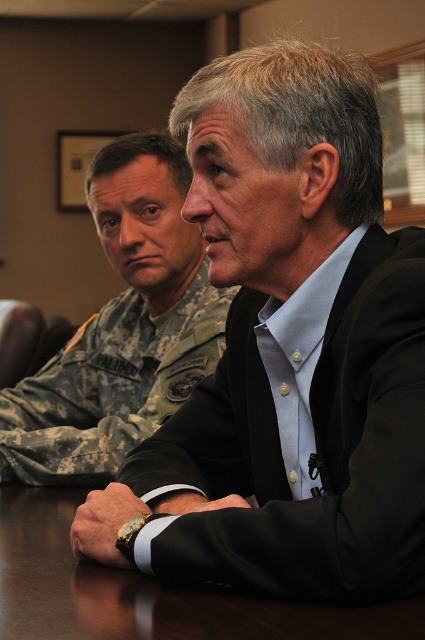
Is black matte suit at center wider than dark brown wood table at center?

No, black matte suit at center is not wider than dark brown wood table at center.

Is black matte suit at center further to the viewer compared to dark brown wood table at center?

Yes, it is.

This screenshot has height=640, width=425. Describe the element at coordinates (286, 353) in the screenshot. I see `black matte suit at center` at that location.

Find the location of a particular element. black matte suit at center is located at coordinates (286, 353).

Which is more to the right, camouflage uniform at left or dark brown wood table at center?

dark brown wood table at center

Based on the photo, is camouflage uniform at left above dark brown wood table at center?

Yes, camouflage uniform at left is above dark brown wood table at center.

Identify the location of camouflage uniform at left. (121, 326).

Which is more to the left, black matte suit at center or camouflage uniform at left?

camouflage uniform at left

Is black matte suit at center below camouflage uniform at left?

Indeed, black matte suit at center is positioned under camouflage uniform at left.

The height and width of the screenshot is (640, 425). Find the location of `black matte suit at center`. black matte suit at center is located at coordinates (286, 353).